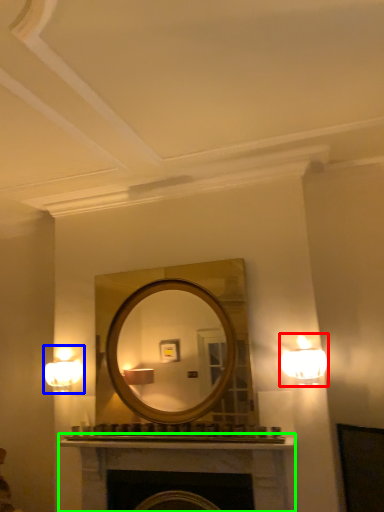
Question: Considering the real-world distances, which object is farthest from lamp (highlighted by a red box)? fixture (highlighted by a blue box) or fireplace (highlighted by a green box)?

Choices:
 (A) fixture
 (B) fireplace

Answer: (A)